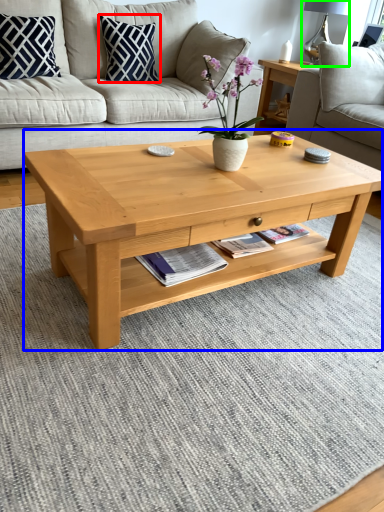
Question: Which is farther away from pillow (highlighted by a red box)? coffee table (highlighted by a blue box) or lamp (highlighted by a green box)?

Choices:
 (A) coffee table
 (B) lamp

Answer: (B)